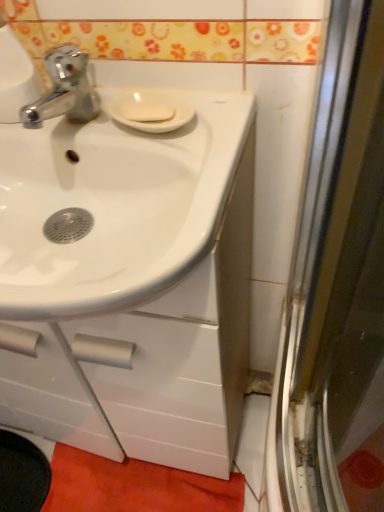
I want to click on free spot in front of white matte soap at center, so click(x=181, y=156).